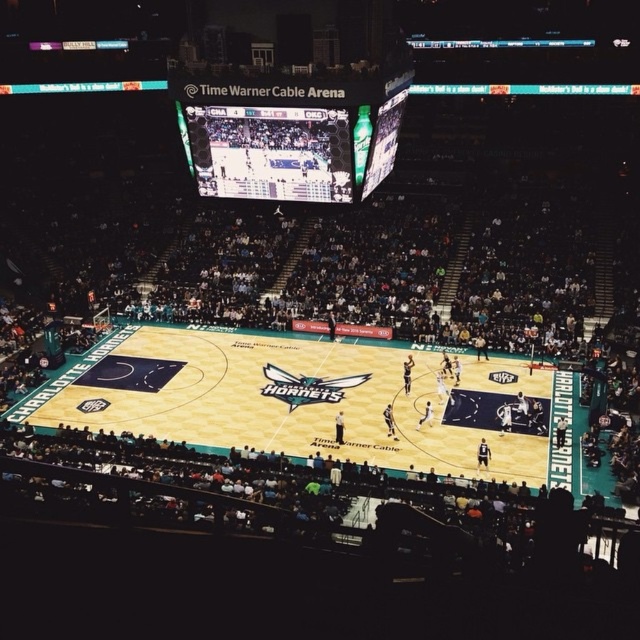
Which is below, teal glossy basketball court at center or matte black scoreboard at upper center?

Positioned lower is teal glossy basketball court at center.

Between point (433, 362) and point (321, 184), which one is positioned in front?

Positioned in front is point (321, 184).

The width and height of the screenshot is (640, 640). I want to click on teal glossy basketball court at center, so click(x=308, y=401).